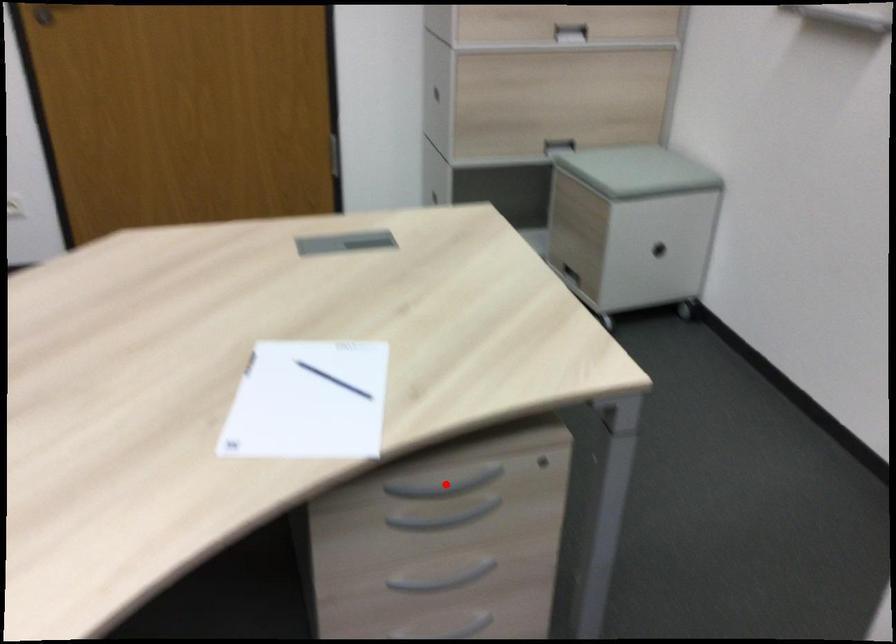
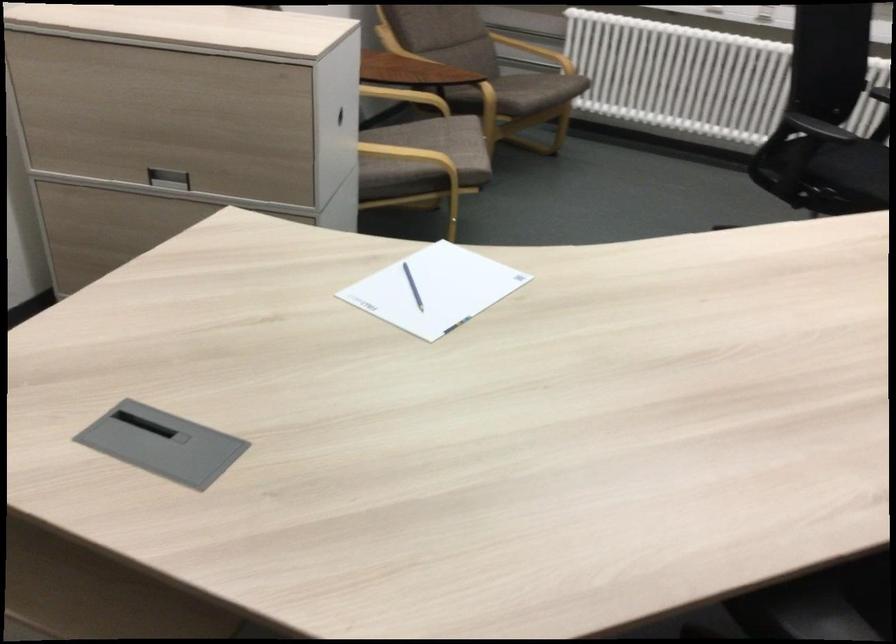
Question: I am providing you with two images of the same scene from different viewpoints. A red point is marked on the first image. At the location where the point appears in image 1, is it still visible in image 2?

Choices:
 (A) Yes
 (B) No

Answer: (B)